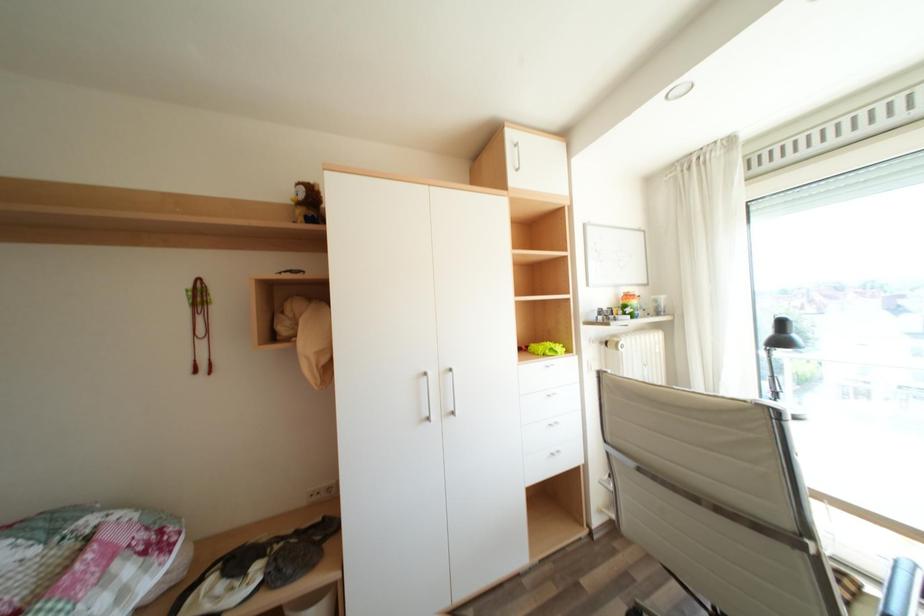
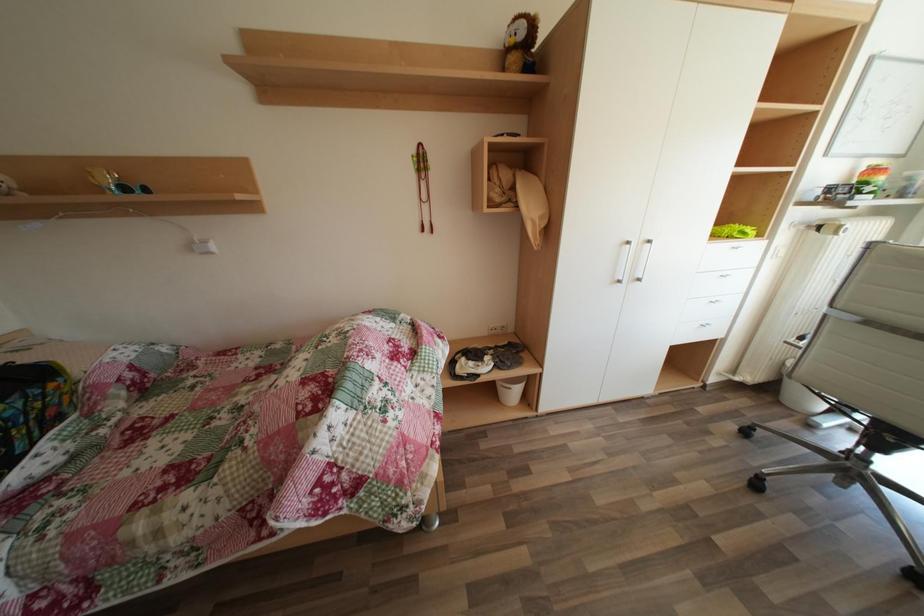
The images are taken continuously from a first-person perspective. In which direction are you moving?

The cameraman moved toward left, backward.